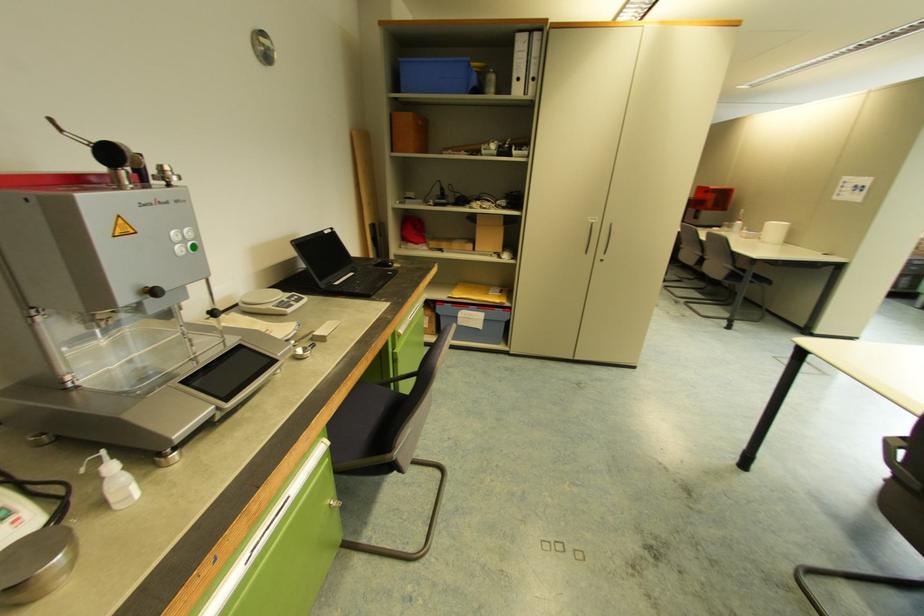
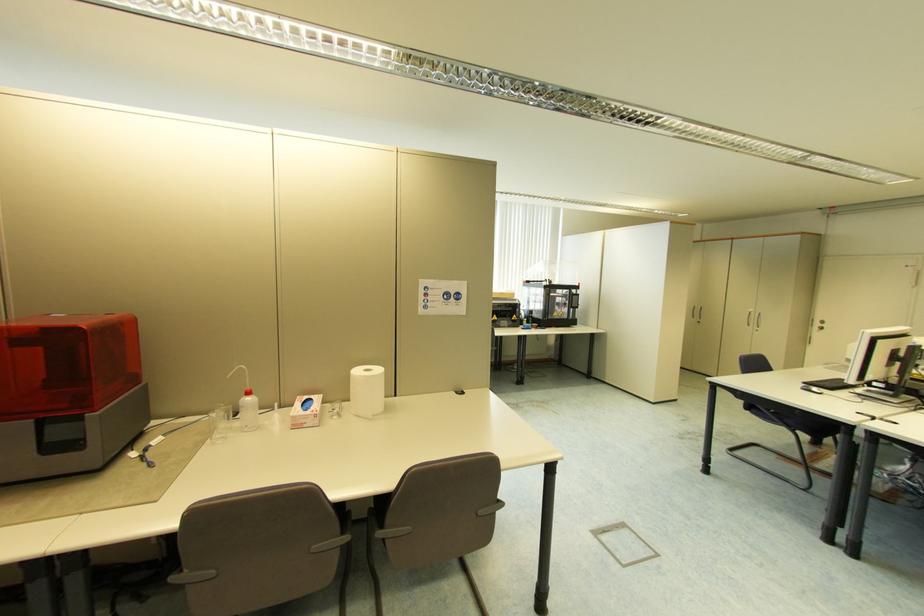
Question: I am providing you with two images of the same scene from different viewpoints. After the viewpoint changes to image2, which objects are now occluded?

Choices:
 (A) computer mouse
 (B) small cardboard box
 (C) paper towel roll
 (D) none of these

Answer: (D)